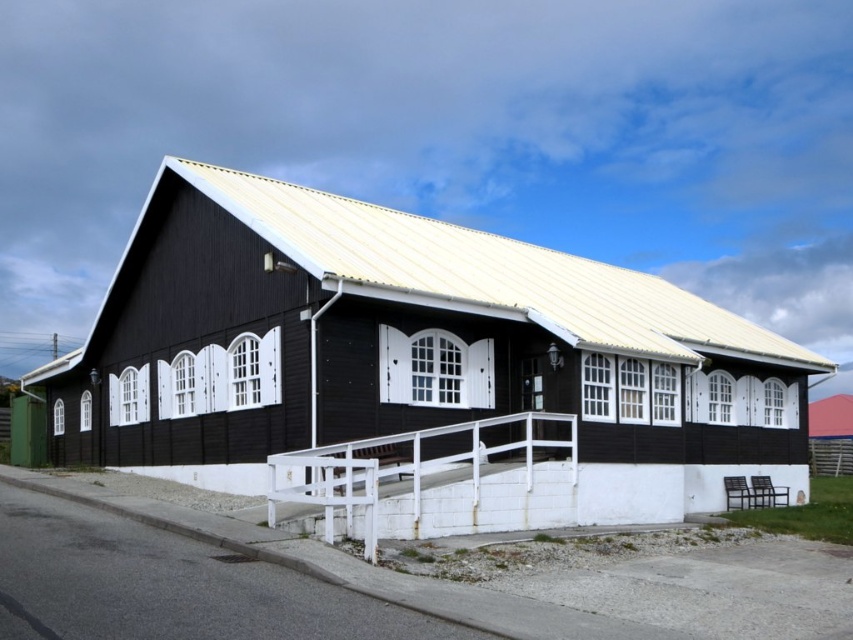
You are a delivery person trying to park your van which is 2 meters wide. You need to know if the space between the black wood house at center and the white painted wood rail at center is wide enough. Can you fit your van there?

The black wood house at center might be wider than white painted wood rail at center, so it is uncertain if the space between them is wide enough for a 2 meter wide van. Check the actual width before parking.

You are a painter who needs to reach the top of the black wood house at center and the white painted wood rail at center. Which object will require a taller ladder?

The black wood house at center requires a taller ladder because it has a greater height compared to the white painted wood rail at center.